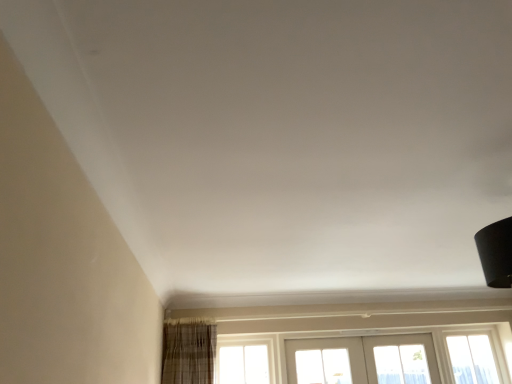
Question: From a real-world perspective, is clear glass window at lower right, placed as the 1th window when sorted from right to left, above or below white painted wood screen door at lower center?

Choices:
 (A) below
 (B) above

Answer: (A)

Question: Is clear glass window at lower right, the 2th window from the left, wider or thinner than white painted wood screen door at lower center?

Choices:
 (A) thin
 (B) wide

Answer: (B)

Question: Estimate the real-world distances between objects in this image. Which object is closer to the clear glass window at center, placed as the 1th window when sorted from left to right?

Choices:
 (A) white painted wood screen door at lower center
 (B) clear glass window at lower right, placed as the 1th window when sorted from right to left

Answer: (A)

Question: Which object is positioned farthest from the white painted wood screen door at lower center?

Choices:
 (A) clear glass window at lower right, placed as the 1th window when sorted from right to left
 (B) clear glass window at center, marked as the second window in a right-to-left arrangement

Answer: (B)